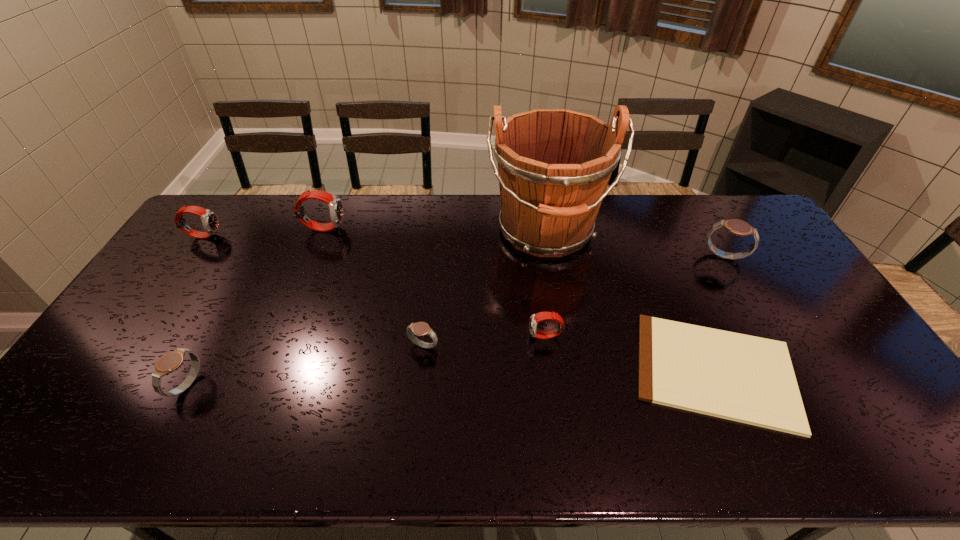
In order to click on vacant space that is in between the bucket and the second gray watch from left to right in this screenshot , I will do `click(485, 289)`.

The image size is (960, 540). In order to click on free space that is in between the second biggest red watch and the smallest red watch in this screenshot , I will do `click(374, 286)`.

Where is `vacant space in between the nearest watch and the clipboard`? The height and width of the screenshot is (540, 960). vacant space in between the nearest watch and the clipboard is located at coordinates (452, 378).

Where is `the seventh closest object to the nearest gray watch`? the seventh closest object to the nearest gray watch is located at coordinates (738, 227).

Find the location of `object that is the fourth closest to the fifth watch from left to right`. object that is the fourth closest to the fifth watch from left to right is located at coordinates (738, 227).

You are a GUI agent. You are given a task and a screenshot of the screen. Output one action in this format:
    pyautogui.click(x=<x>, y=<y>)
    Task: Click on the watch that is the fourth closest to the smallest red watch
    
    Given the screenshot: What is the action you would take?
    pyautogui.click(x=170, y=362)

The image size is (960, 540). I want to click on watch identified as the third closest to the second biggest red watch, so click(420, 328).

Identify which red watch is the second nearest to the smallest red watch. Please provide its 2D coordinates. Your answer should be formatted as a tuple, i.e. [(x, y)], where the tuple contains the x and y coordinates of a point satisfying the conditions above.

[(210, 222)]

Choose which red watch is the nearest neighbor to the bucket. Please provide its 2D coordinates. Your answer should be formatted as a tuple, i.e. [(x, y)], where the tuple contains the x and y coordinates of a point satisfying the conditions above.

[(535, 318)]

Point out which gray watch is positioned as the nearest to the shortest object. Please provide its 2D coordinates. Your answer should be formatted as a tuple, i.e. [(x, y)], where the tuple contains the x and y coordinates of a point satisfying the conditions above.

[(738, 227)]